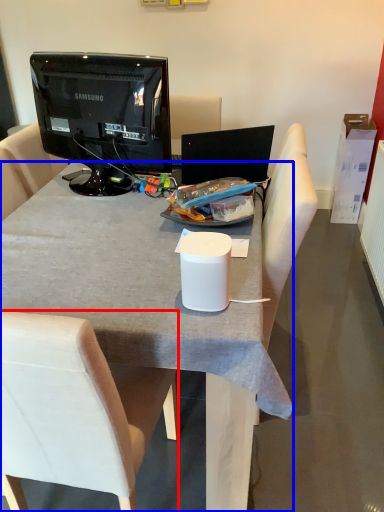
Question: Which object is closer to the camera taking this photo, chair (highlighted by a red box) or desk (highlighted by a blue box)?

Choices:
 (A) chair
 (B) desk

Answer: (A)